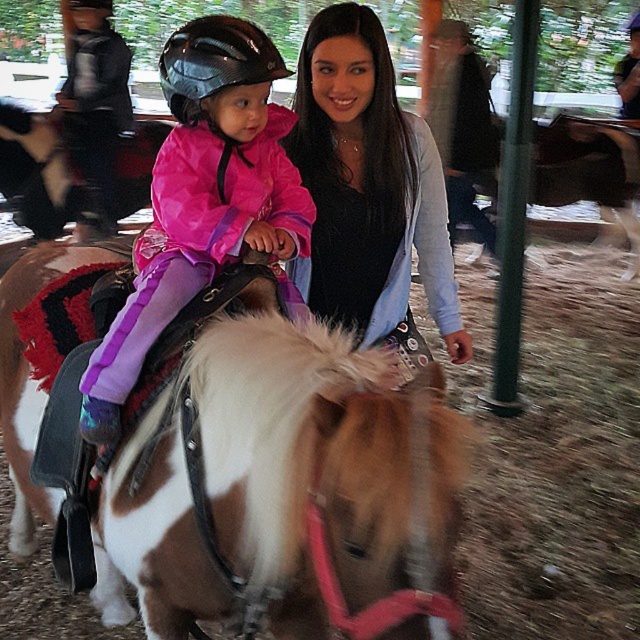
Is brown and white speckled horse at center in front of black glossy helmet at upper center?

Yes, brown and white speckled horse at center is in front of black glossy helmet at upper center.

Could you measure the distance between brown and white speckled horse at center and black glossy helmet at upper center?

They are 30.53 inches apart.

Image resolution: width=640 pixels, height=640 pixels. What do you see at coordinates (234, 468) in the screenshot? I see `brown and white speckled horse at center` at bounding box center [234, 468].

Identify the location of brown and white speckled horse at center. (234, 468).

Who is taller, pink matte jacket at upper left or smooth black shirt at center?

Standing taller between the two is smooth black shirt at center.

Can you confirm if pink matte jacket at upper left is positioned below smooth black shirt at center?

Yes, pink matte jacket at upper left is below smooth black shirt at center.

Is point (140, 349) behind point (435, 225)?

No.

I want to click on pink matte jacket at upper left, so click(202, 196).

Is the position of smooth black shirt at center more distant than that of brushed metal helmet at upper left?

No, smooth black shirt at center is in front of brushed metal helmet at upper left.

Find the location of a particular element. The height and width of the screenshot is (640, 640). smooth black shirt at center is located at coordinates (369, 188).

Who is more forward, (372,72) or (90,113)?

Point (372,72)

You are a GUI agent. You are given a task and a screenshot of the screen. Output one action in this format:
    pyautogui.click(x=<x>, y=<y>)
    Task: Click on the smooth black shirt at center
    
    Given the screenshot: What is the action you would take?
    pyautogui.click(x=369, y=188)